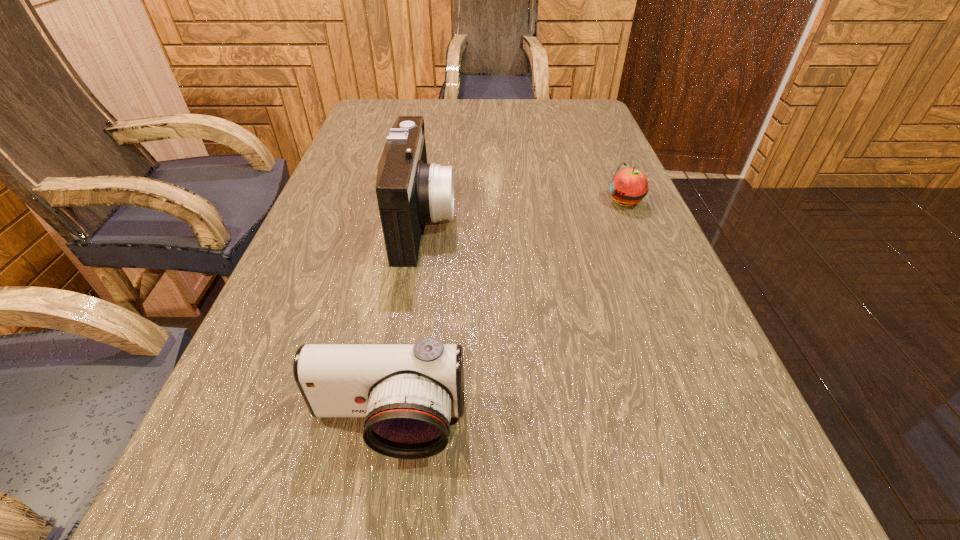
Find the location of a particular element. The image size is (960, 540). vacant space that satisfies the following two spatial constraints: 1. on the lens of the tallest object; 2. on the surface of the nearer camcorder is located at coordinates (391, 426).

I want to click on vacant area in the image that satisfies the following two spatial constraints: 1. on the lens of the tallest object; 2. on the surface of the shorter camcorder, so click(391, 426).

Locate an element on the screen. blank area in the image that satisfies the following two spatial constraints: 1. on the lens of the farther camcorder; 2. on the surface of the nearest object is located at coordinates (391, 426).